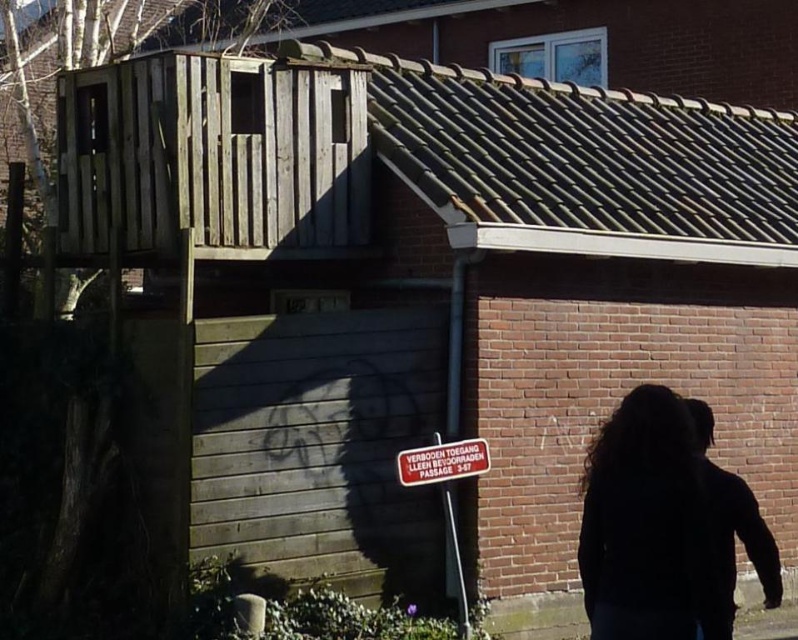
Is point (611, 442) less distant than point (437, 452)?

Yes, point (611, 442) is closer to viewer.

Which is below, black matte hair at lower right or metallic reflective sign at center?

metallic reflective sign at center is below.

Is point (702, 604) closer to camera compared to point (439, 452)?

Yes, point (702, 604) is closer to viewer.

Identify the location of black matte hair at lower right. Image resolution: width=798 pixels, height=640 pixels. (646, 525).